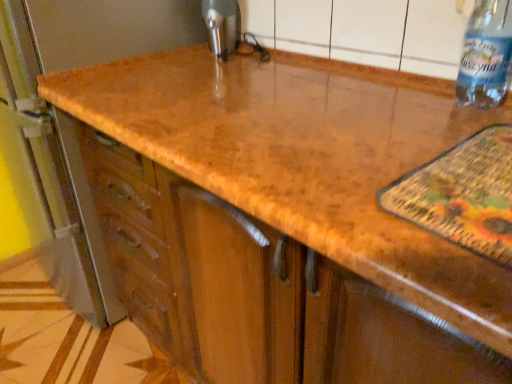
In order to face metallic faucet at upper center, should I rotate leftwards or rightwards?

Turn left by 5.233 degrees to look at metallic faucet at upper center.

This screenshot has width=512, height=384. Describe the element at coordinates (222, 26) in the screenshot. I see `metallic faucet at upper center` at that location.

The image size is (512, 384). Identify the location of metallic faucet at upper center. (222, 26).

This screenshot has width=512, height=384. What do you see at coordinates (485, 55) in the screenshot?
I see `transparent plastic bottle at upper right` at bounding box center [485, 55].

Where is `transparent plastic bottle at upper right`? The height and width of the screenshot is (384, 512). transparent plastic bottle at upper right is located at coordinates (485, 55).

Locate an element on the screen. The width and height of the screenshot is (512, 384). metallic faucet at upper center is located at coordinates (222, 26).

Based on their positions, is metallic faucet at upper center located to the left or right of transparent plastic bottle at upper right?

From the image, it's evident that metallic faucet at upper center is to the left of transparent plastic bottle at upper right.

Between metallic faucet at upper center and transparent plastic bottle at upper right, which one is positioned behind?

metallic faucet at upper center is further away from the camera.

Is point (217, 4) positioned behind point (494, 32)?

Yes, point (217, 4) is behind point (494, 32).

From the image's perspective, between metallic faucet at upper center and transparent plastic bottle at upper right, which one is located above?

metallic faucet at upper center is shown above in the image.

From a real-world perspective, between metallic faucet at upper center and transparent plastic bottle at upper right, who is vertically higher?

transparent plastic bottle at upper right is physically above.

Does metallic faucet at upper center have a lesser width compared to transparent plastic bottle at upper right?

Yes, metallic faucet at upper center is thinner than transparent plastic bottle at upper right.

Looking at this image, is metallic faucet at upper center taller than transparent plastic bottle at upper right?

In fact, metallic faucet at upper center may be shorter than transparent plastic bottle at upper right.

Can you confirm if metallic faucet at upper center is bigger than transparent plastic bottle at upper right?

No, metallic faucet at upper center is not bigger than transparent plastic bottle at upper right.

Is metallic faucet at upper center located outside transparent plastic bottle at upper right?

That's correct, metallic faucet at upper center is outside of transparent plastic bottle at upper right.

Is metallic faucet at upper center not close to transparent plastic bottle at upper right?

They are positioned close to each other.

Is metallic faucet at upper center facing away from transparent plastic bottle at upper right?

No, metallic faucet at upper center is not facing the opposite direction of transparent plastic bottle at upper right.

Can you tell me how much metallic faucet at upper center and transparent plastic bottle at upper right differ in facing direction?

The angle between the facing direction of metallic faucet at upper center and the facing direction of transparent plastic bottle at upper right is 0.000198 degrees.

The width and height of the screenshot is (512, 384). What are the coordinates of `bottle below the metallic faucet at upper center (from the image's perspective)` in the screenshot? It's located at (485, 55).

In the image, is transparent plastic bottle at upper right on the left side or the right side of metallic faucet at upper center?

In the image, transparent plastic bottle at upper right appears on the right side of metallic faucet at upper center.

From the picture: Is transparent plastic bottle at upper right positioned in front of metallic faucet at upper center?

Yes, the depth of transparent plastic bottle at upper right is less than that of metallic faucet at upper center.

Does point (487, 10) lie behind point (215, 51)?

No, (487, 10) is in front of (215, 51).

From the image's perspective, is transparent plastic bottle at upper right over metallic faucet at upper center?

Actually, transparent plastic bottle at upper right appears below metallic faucet at upper center in the image.

From a real-world perspective, is transparent plastic bottle at upper right on metallic faucet at upper center?

Indeed, from a real-world perspective, transparent plastic bottle at upper right stands above metallic faucet at upper center.

Can you confirm if transparent plastic bottle at upper right is wider than metallic faucet at upper center?

Correct, the width of transparent plastic bottle at upper right exceeds that of metallic faucet at upper center.

Can you confirm if transparent plastic bottle at upper right is shorter than metallic faucet at upper center?

No, transparent plastic bottle at upper right is not shorter than metallic faucet at upper center.

Who is bigger, transparent plastic bottle at upper right or metallic faucet at upper center?

transparent plastic bottle at upper right is bigger.

Is transparent plastic bottle at upper right situated inside metallic faucet at upper center or outside?

transparent plastic bottle at upper right exists outside the volume of metallic faucet at upper center.

Would you consider transparent plastic bottle at upper right to be distant from metallic faucet at upper center?

No, there isn't a large distance between transparent plastic bottle at upper right and metallic faucet at upper center.

Does transparent plastic bottle at upper right turn towards metallic faucet at upper center?

No.

How distant is transparent plastic bottle at upper right from metallic faucet at upper center?

transparent plastic bottle at upper right is 27.98 inches from metallic faucet at upper center.

You are a GUI agent. You are given a task and a screenshot of the screen. Output one action in this format:
    pyautogui.click(x=<x>, y=<y>)
    Task: Click on the appliance on the left of the transparent plastic bottle at upper right
    The height and width of the screenshot is (384, 512).
    Given the screenshot: What is the action you would take?
    pyautogui.click(x=222, y=26)

The height and width of the screenshot is (384, 512). I want to click on appliance on the left side of transparent plastic bottle at upper right, so click(x=222, y=26).

Identify the location of bottle that is below the metallic faucet at upper center (from the image's perspective). (485, 55).